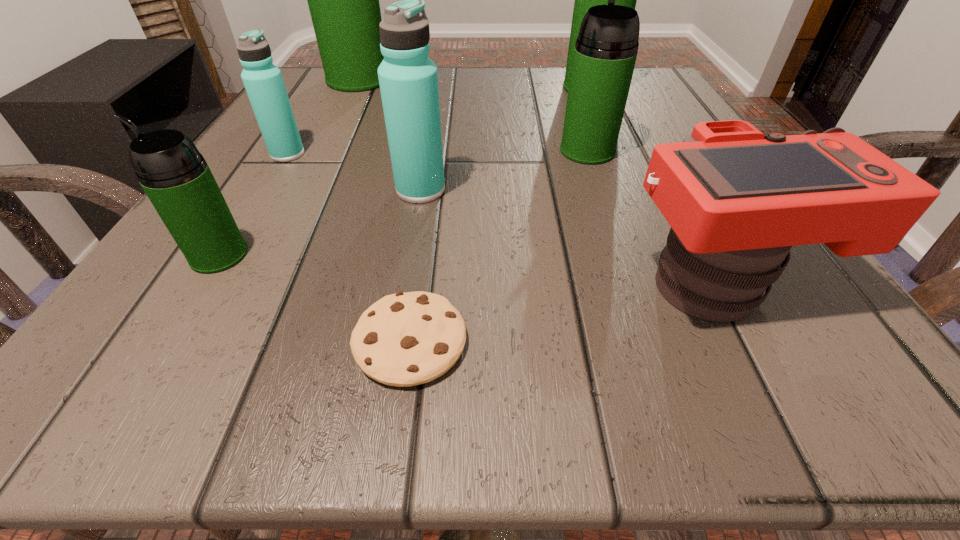
Locate an element on the screen. the nearest thermos bottle is located at coordinates (175, 176).

You are a GUI agent. You are given a task and a screenshot of the screen. Output one action in this format:
    pyautogui.click(x=<x>, y=<y>)
    Task: Click on the camera
    This screenshot has width=960, height=540.
    Given the screenshot: What is the action you would take?
    pyautogui.click(x=737, y=200)

Find the location of a particular element. This screenshot has width=960, height=540. cookie is located at coordinates (405, 339).

The image size is (960, 540). What are the coordinates of `the shortest object` in the screenshot? It's located at (405, 339).

The image size is (960, 540). What are the coordinates of `vacant region located 0.370m from the spout of the second biggest green thermos bottle` in the screenshot? It's located at (382, 88).

Locate an element on the screen. vacant area situated 0.340m from the spout of the second biggest green thermos bottle is located at coordinates (396, 88).

The height and width of the screenshot is (540, 960). Identify the location of vacant area located 0.290m from the spout of the second biggest green thermos bottle. (421, 88).

The width and height of the screenshot is (960, 540). I want to click on vacant space located 0.120m from the spout of the second nearest green thermos bottle, so click(x=572, y=107).

You are a GUI agent. You are given a task and a screenshot of the screen. Output one action in this format:
    pyautogui.click(x=<x>, y=<y>)
    Task: Click on the free space located from the spout of the second nearest green thermos bottle
    This screenshot has height=540, width=960.
    Given the screenshot: What is the action you would take?
    pyautogui.click(x=576, y=119)

You are a GUI agent. You are given a task and a screenshot of the screen. Output one action in this format:
    pyautogui.click(x=<x>, y=<y>)
    Task: Click on the vacant space located 0.090m from the spout of the second nearest green thermos bottle
    
    Given the screenshot: What is the action you would take?
    pyautogui.click(x=575, y=114)